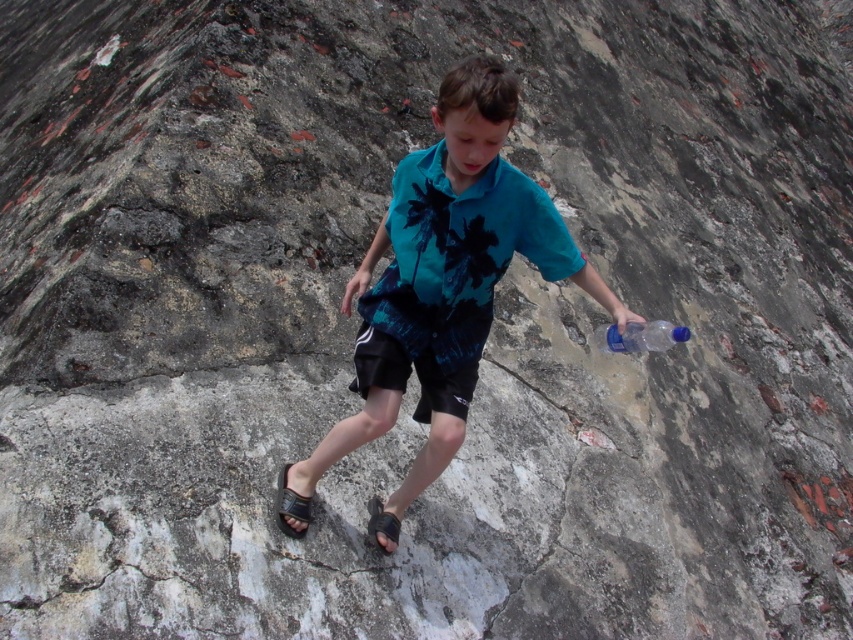
Question: Which point appears farthest from the camera in this image?

Choices:
 (A) (426, 182)
 (B) (660, 324)
 (C) (390, 285)

Answer: (C)

Question: Is black leather sandal at lower left in front of black rubber sandal at lower center?

Choices:
 (A) yes
 (B) no

Answer: (A)

Question: Is translucent plastic bottle at right to the left of black rubber sandal at lower center from the viewer's perspective?

Choices:
 (A) yes
 (B) no

Answer: (B)

Question: Is black leather sandal at lower left to the right of black rubber sandal at lower center from the viewer's perspective?

Choices:
 (A) no
 (B) yes

Answer: (A)

Question: Among these objects, which one is farthest from the camera?

Choices:
 (A) translucent plastic bottle at right
 (B) black leather sandal at lower left
 (C) teal fabric shirt at center

Answer: (B)

Question: Which object appears farthest from the camera in this image?

Choices:
 (A) teal fabric shirt at center
 (B) black matte shorts at center
 (C) black leather sandal at lower left
 (D) black rubber sandal at lower center

Answer: (D)